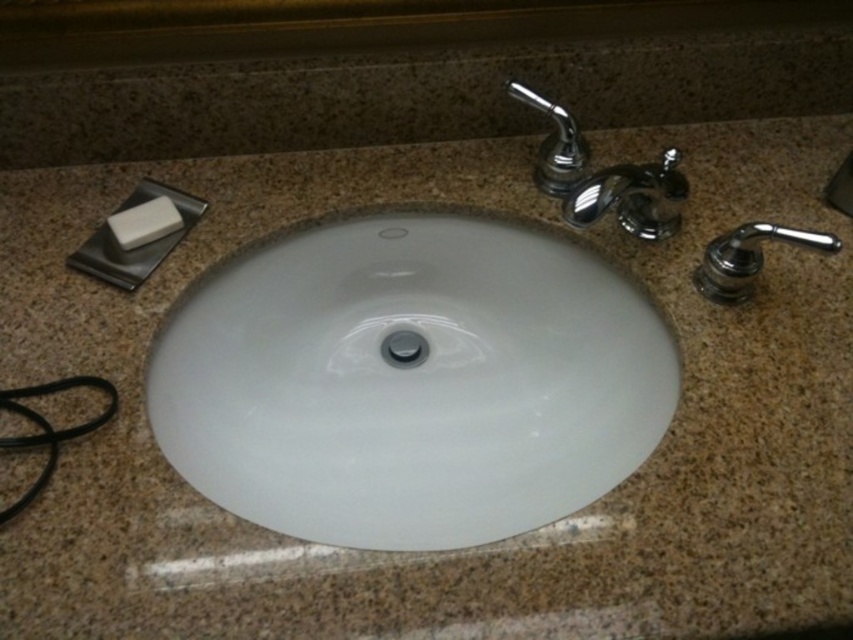
Describe the element at coordinates (410, 381) in the screenshot. I see `white glossy sink at center` at that location.

Between point (311, 333) and point (758, 250), which one is positioned behind?

The point (311, 333) is more distant.

Locate an element on the screen. white glossy sink at center is located at coordinates (410, 381).

Which is more to the left, chrome metallic faucet at upper right or white matte soap at upper left?

white matte soap at upper left is more to the left.

Is point (589, 212) positioned behind point (109, 220)?

No, (589, 212) is closer to viewer.

Which is in front, point (660, 195) or point (135, 220)?

Positioned in front is point (660, 195).

At what (x,y) coordinates should I click in order to perform the action: click on chrome metallic faucet at upper right. Please return your answer as a coordinate pair (x, y). This screenshot has height=640, width=853. Looking at the image, I should click on (631, 196).

Between chrome metallic faucet at upper right and polished chrome faucet at upper right, which one appears on the right side from the viewer's perspective?

chrome metallic faucet at upper right

Between point (627, 202) and point (540, 108), which one is positioned in front?

Point (540, 108)

At what (x,y) coordinates should I click in order to perform the action: click on chrome metallic faucet at upper right. Please return your answer as a coordinate pair (x, y). This screenshot has height=640, width=853. Looking at the image, I should click on pos(631,196).